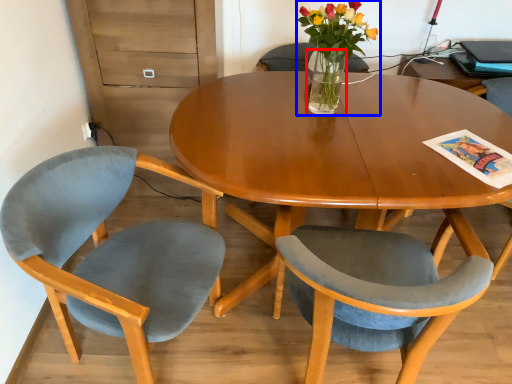
Question: Which object is closer to the camera taking this photo, vase (highlighted by a red box) or houseplant (highlighted by a blue box)?

Choices:
 (A) vase
 (B) houseplant

Answer: (B)